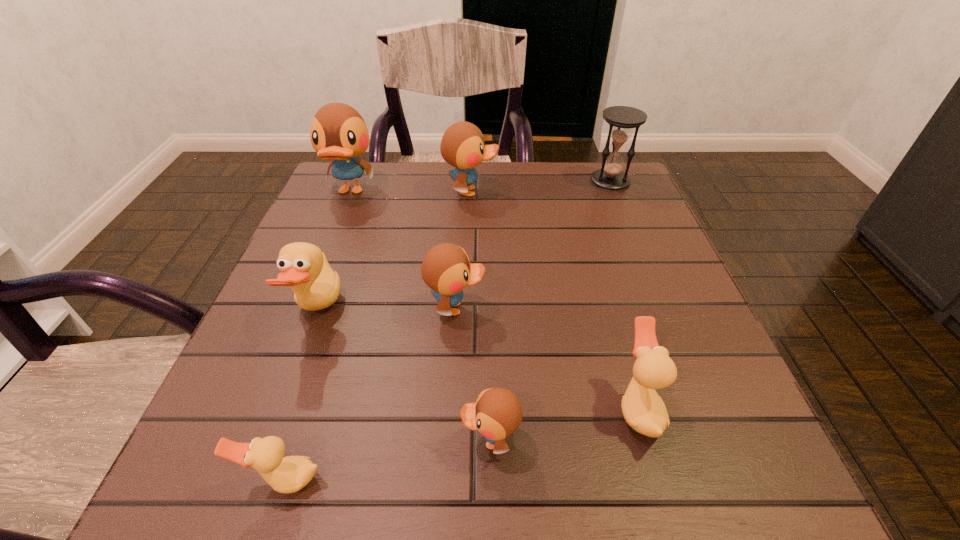
I want to click on the tallest duck, so click(338, 132).

Locate an element on the screen. The width and height of the screenshot is (960, 540). the leftmost blue duck is located at coordinates (338, 132).

In order to click on the third smallest blue duck in this screenshot , I will do `click(462, 146)`.

I want to click on the rightmost object, so click(622, 119).

Identify the location of hourglass. Image resolution: width=960 pixels, height=540 pixels. (622, 119).

You are a GUI agent. You are given a task and a screenshot of the screen. Output one action in this format:
    pyautogui.click(x=<x>, y=<y>)
    Task: Click on the biggest tan duck
    The height and width of the screenshot is (540, 960).
    Given the screenshot: What is the action you would take?
    pyautogui.click(x=304, y=266)

Find the location of a particular element. The image size is (960, 540). the second smallest blue duck is located at coordinates (446, 269).

Identify the location of the seventh object from left to right. (643, 409).

Image resolution: width=960 pixels, height=540 pixels. What are the coordinates of `the second farthest tan duck` in the screenshot? It's located at (643, 409).

This screenshot has width=960, height=540. Find the location of `the smallest blue duck`. the smallest blue duck is located at coordinates (497, 414).